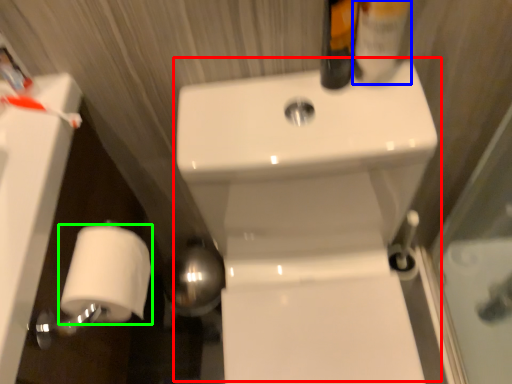
Question: Which is farther away from sink (highlighted by a red box)? mouthwash (highlighted by a blue box) or toilet paper (highlighted by a green box)?

Choices:
 (A) mouthwash
 (B) toilet paper

Answer: (B)